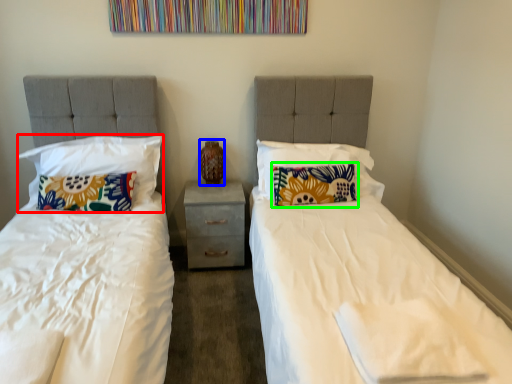
Question: Estimate the real-world distances between objects in this image. Which object is farther from pillow (highlighted by a red box), vase (highlighted by a blue box) or pillow (highlighted by a green box)?

Choices:
 (A) vase
 (B) pillow

Answer: (B)